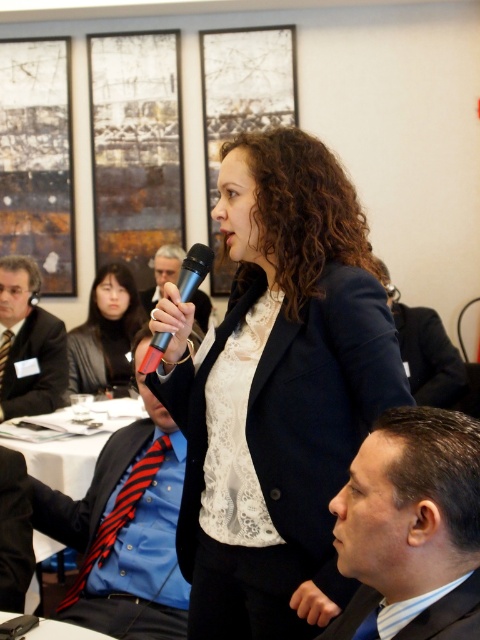
Question: Which is nearer to the blue striped tie at center?

Choices:
 (A) black leather jacket at upper left
 (B) dark blue suit at center
 (C) blue striped fabric at lower right

Answer: (C)

Question: Which object is closer to the camera taking this photo?

Choices:
 (A) blue striped fabric at lower right
 (B) metallic silver microphone at center
 (C) black leather jacket at upper left

Answer: (A)

Question: Where is black smooth suit at lower right located in relation to blue striped fabric at lower right in the image?

Choices:
 (A) below
 (B) above

Answer: (B)

Question: Is the position of dark blue suit at center more distant than that of matte black microphone at center?

Choices:
 (A) yes
 (B) no

Answer: (B)

Question: Which object is closer to the camera taking this photo?

Choices:
 (A) blue striped tie at center
 (B) black smooth suit at lower right
 (C) blue striped fabric at lower right
 (D) black leather jacket at upper left

Answer: (C)

Question: Is dark blue suit at center positioned in front of blue striped tie at center?

Choices:
 (A) no
 (B) yes

Answer: (B)